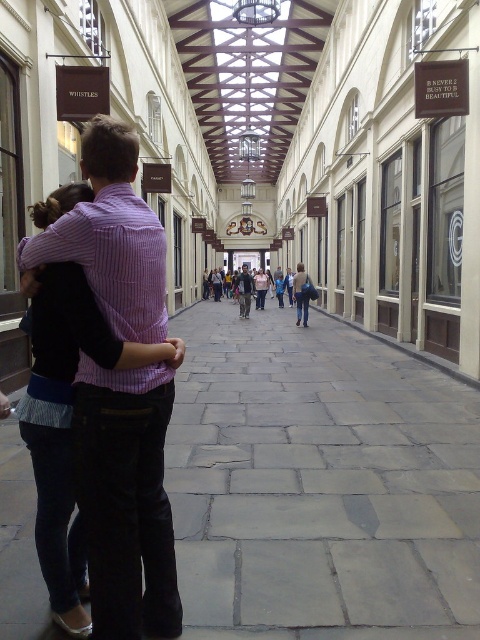
Does matte pink shirt at center have a greater height compared to denim jacket at center?

Yes.

This screenshot has width=480, height=640. Describe the element at coordinates (249, 289) in the screenshot. I see `matte pink shirt at center` at that location.

You are a GUI agent. You are given a task and a screenshot of the screen. Output one action in this format:
    pyautogui.click(x=<x>, y=<y>)
    Task: Click on the matte pink shirt at center
    The width and height of the screenshot is (480, 640).
    Given the screenshot: What is the action you would take?
    pyautogui.click(x=249, y=289)

Does point (96, 307) come in front of point (255, 296)?

Yes, it is in front of point (255, 296).

Which is below, black denim jeans at left or light pink fabric dress at center?

black denim jeans at left is below.

Find the location of a particular element. The image size is (480, 640). black denim jeans at left is located at coordinates (72, 413).

Is matte pink shirt at center taller than light pink fabric dress at center?

Yes.

Which of these two, matte pink shirt at center or light pink fabric dress at center, stands taller?

Standing taller between the two is matte pink shirt at center.

Between point (280, 292) and point (265, 289), which one is positioned behind?

The point (280, 292) is more distant.

The image size is (480, 640). I want to click on matte pink shirt at center, so [249, 289].